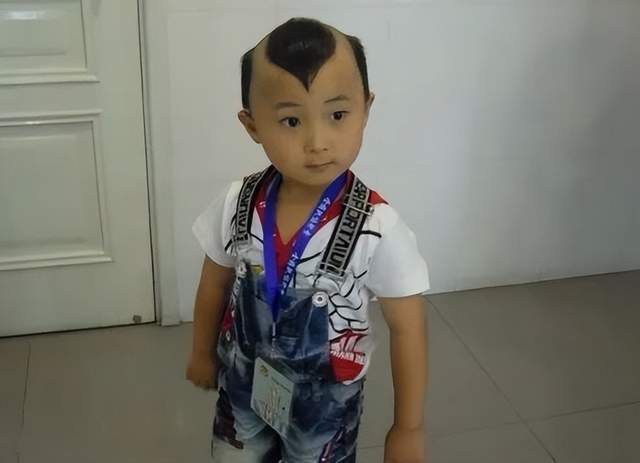
The width and height of the screenshot is (640, 463). What are the coordinates of `door` in the screenshot? It's located at (43, 190).